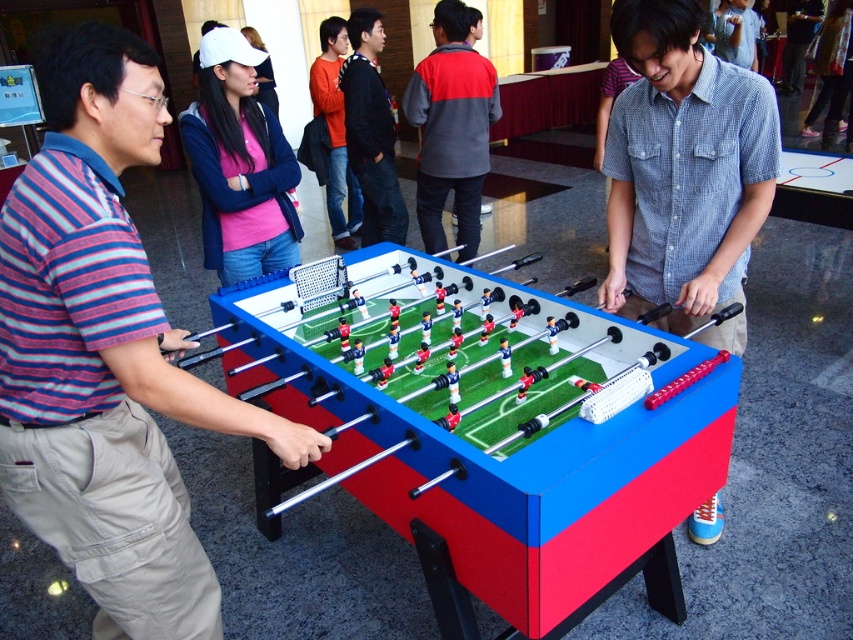
Does blue checkered shirt at center have a smaller size compared to matte pink shirt at upper center?

No.

Between point (618, 108) and point (207, 109), which one is positioned behind?

The point (207, 109) is behind.

I want to click on blue checkered shirt at center, so click(683, 168).

Which is more to the left, blue plastic foosball table at center or gray/red fleece jacket at center?

blue plastic foosball table at center

This screenshot has height=640, width=853. What are the coordinates of `blue plastic foosball table at center` in the screenshot? It's located at (490, 428).

Can you confirm if blue checkered shirt at center is thinner than orange shirt at center?

No.

Is point (631, 252) closer to camera compared to point (338, 19)?

Yes, it is in front of point (338, 19).

Locate an element on the screen. blue checkered shirt at center is located at coordinates (683, 168).

Find the location of a particular element. The height and width of the screenshot is (640, 853). blue checkered shirt at center is located at coordinates (683, 168).